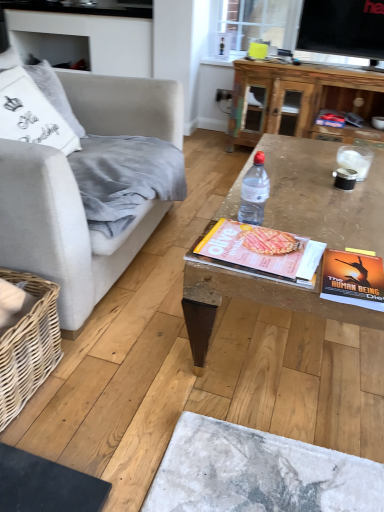
The height and width of the screenshot is (512, 384). In order to click on spots to the right of woven wood basket at lower left in this screenshot , I will do `click(99, 406)`.